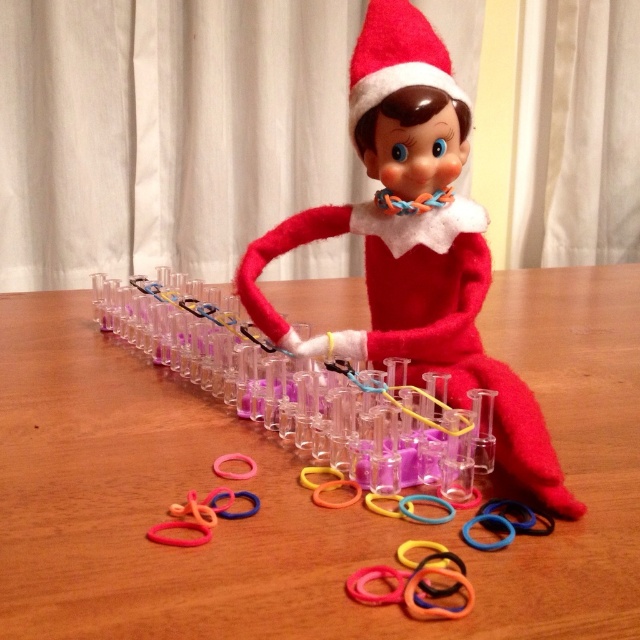
Question: Considering the real-world distances, which object is closest to the rubber band rubber at lower center?

Choices:
 (A) velvet red elf at center
 (B) rubber band at center
 (C) wooden table at center
 (D) rubber band at lower center

Answer: (B)

Question: Observing the image, what is the correct spatial positioning of wooden table at center in reference to rubber band at lower center?

Choices:
 (A) above
 (B) below

Answer: (A)

Question: Which object is farther from the camera taking this photo?

Choices:
 (A) rubber band at center
 (B) wooden table at center
 (C) rubber band rubber at lower center
 (D) velvet red elf at center

Answer: (D)

Question: Does velvet red elf at center have a greater width compared to rubber band rubber at lower center?

Choices:
 (A) no
 (B) yes

Answer: (B)

Question: Which point is closer to the camera?

Choices:
 (A) (490, 508)
 (B) (170, 541)

Answer: (B)

Question: From the image, what is the correct spatial relationship of rubber band at center in relation to rubber band at lower center?

Choices:
 (A) right
 (B) left

Answer: (A)